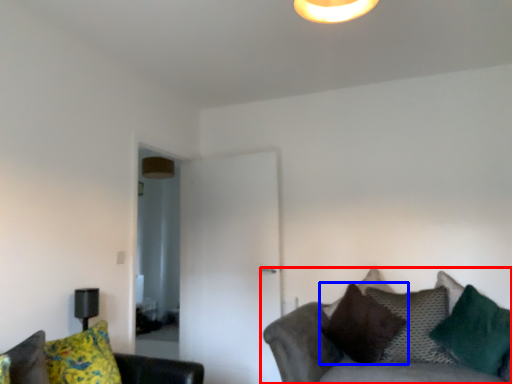
Question: Which of the following is the closest to the observer, studio couch (highlighted by a red box) or pillow (highlighted by a blue box)?

Choices:
 (A) studio couch
 (B) pillow

Answer: (A)